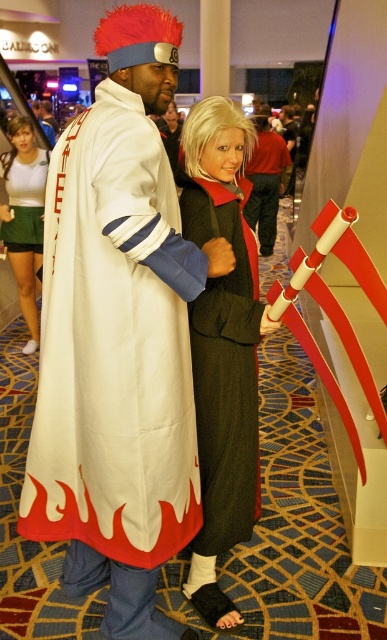
You are a photographer at a convention and want to take a closeup shot of the point at coordinates point (x=10, y=188). The camera you are using has a maximum focus range of 10 feet. Is the point within the camera range?

The distance of point (x=10, y=188) from camera is 12.74 feet, which is beyond the camera maximum focus range of 10 feet. Therefore, the point is not within the camera range.

From the picture: You are a photographer trying to capture a clear shot of both the green wool coat at center and the matte black jacket at center. Since you want both to be in focus, which one should you focus on first to ensure depth of field?

You should focus on the matte black jacket at center first because it is farther away from the viewer than the green wool coat at center, ensuring both are in focus when using depth of field.

You are a photographer at a cosplay event. You want to capture a photo where the white matte cape at center is visible above the matte black jacket at center. Is this possible based on their current positions?

The white matte cape at center is located below the matte black jacket at center, so it cannot be visible above it in the current positions.